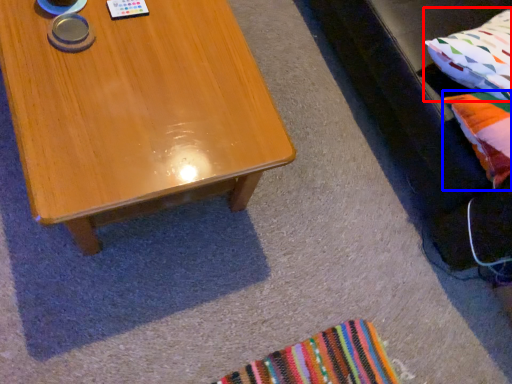
Question: Which object is further to the camera taking this photo, pillow (highlighted by a red box) or pillow (highlighted by a blue box)?

Choices:
 (A) pillow
 (B) pillow

Answer: (A)